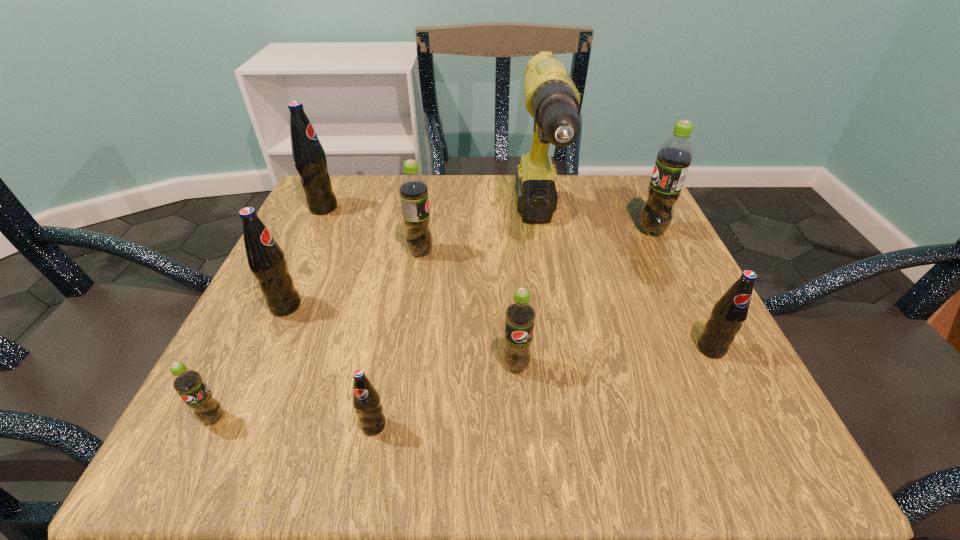
Locate an element on the screen. the tallest object is located at coordinates (551, 97).

Find the location of a particular element. This screenshot has width=960, height=540. the farthest black pop is located at coordinates (309, 158).

Identify the location of the biggest black pop. (309, 158).

This screenshot has height=540, width=960. In order to click on the farthest green soda in this screenshot , I will do `click(674, 157)`.

The image size is (960, 540). Identify the location of the biggest green soda. (674, 157).

You are a GUI agent. You are given a task and a screenshot of the screen. Output one action in this format:
    pyautogui.click(x=<x>, y=<y>)
    Task: Click on the second farthest black pop
    Image resolution: width=960 pixels, height=540 pixels.
    Given the screenshot: What is the action you would take?
    pyautogui.click(x=266, y=260)

Identify the location of the fifth nearest soda. The height and width of the screenshot is (540, 960). tap(266, 260).

I want to click on the third smallest green soda, so click(413, 190).

Locate an element on the screen. the second farthest green soda is located at coordinates (413, 190).

Identify the location of the rightmost black pop. point(727,316).